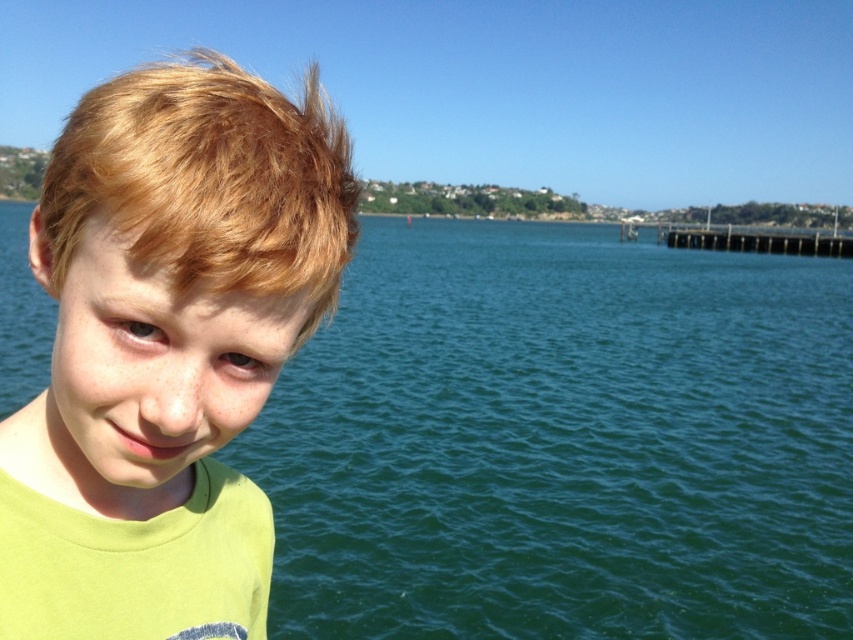
The young boy with blonde hair at left is standing on the wooden pier at right. Is his hair visible from the perspective of someone standing on the pier?

The blonde hair at left is positioned over the wooden pier at right, so yes, the hair is visible from the perspective of someone on the pier.